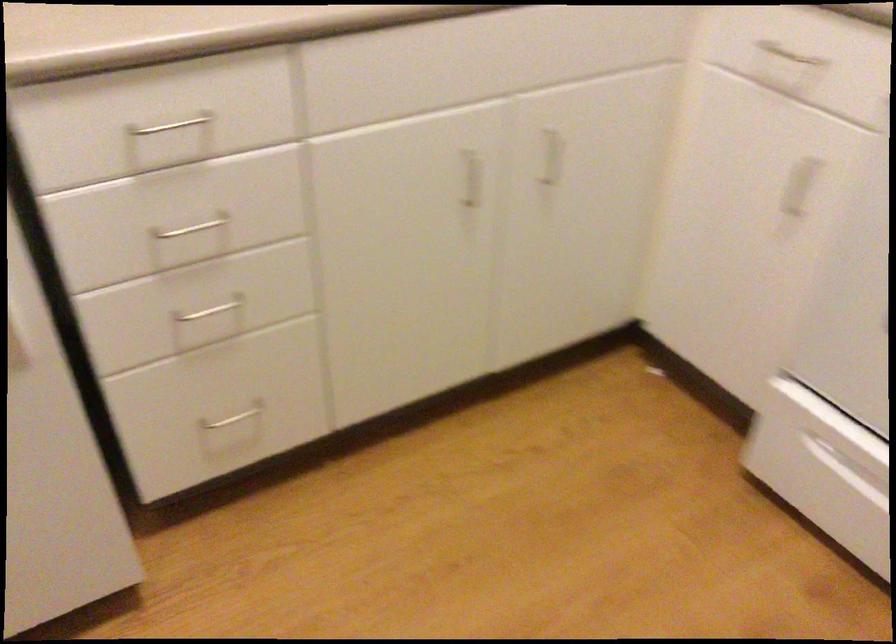
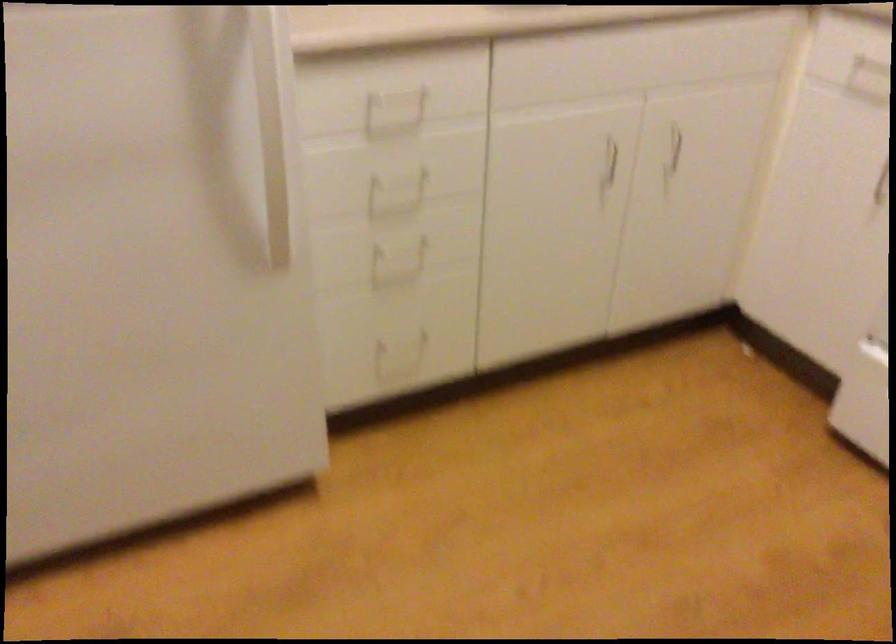
The point at (553, 162) is marked in the first image. Where is the corresponding point in the second image?

(675, 147)